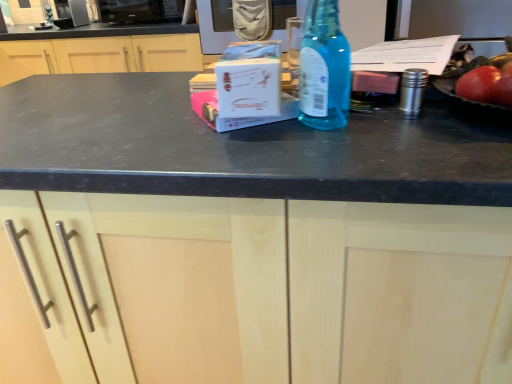
Identify the location of free location in front of satin silver microwave at upper left, the 2th appliance when ordered from right to left. (61, 30).